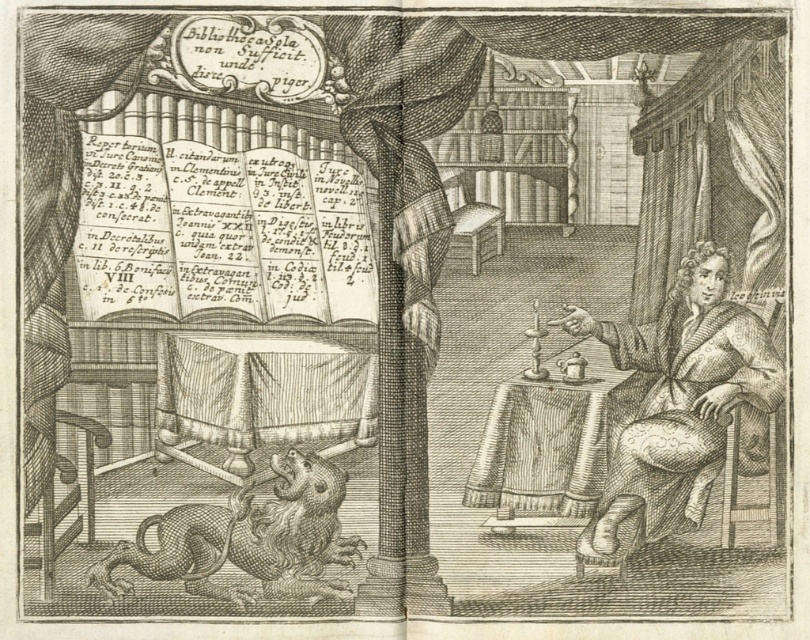
What is located at the coordinates point (680, 401) in the image?

At point (680, 401) lies smooth brown robe at right.

What is the relationship between the height of the smooth brown robe at right and the brown textured lion at lower left?

The smooth brown robe at right has a greater height compared to the brown textured lion at lower left.